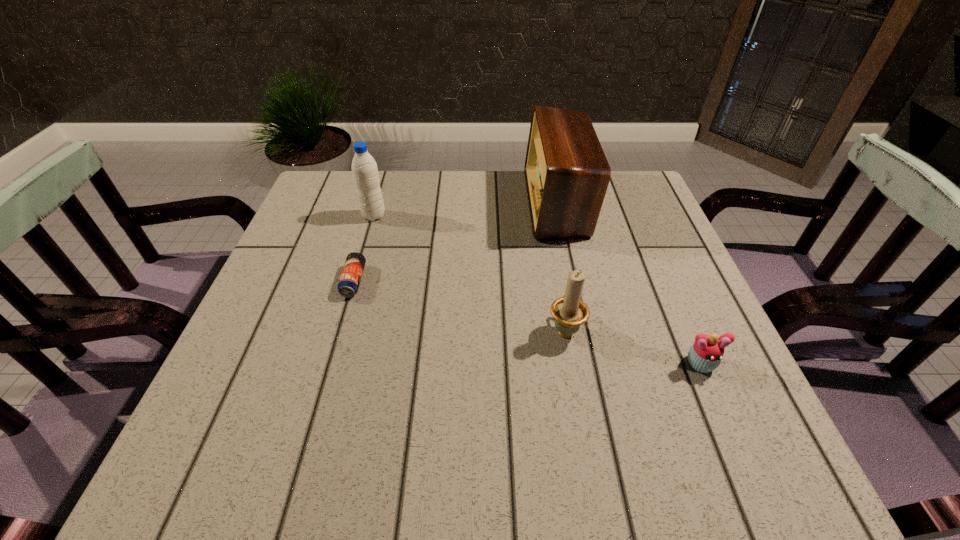
I want to click on free point between the water bottle and the third farthest object, so click(364, 248).

At what (x,y) coordinates should I click in order to perform the action: click on free spot between the cupcake and the water bottle. Please return your answer as a coordinate pair (x, y). Looking at the image, I should click on (537, 290).

Locate an element on the screen. Image resolution: width=960 pixels, height=540 pixels. free area in between the beer can and the radio receiver is located at coordinates (455, 242).

The width and height of the screenshot is (960, 540). What are the coordinates of `vacant point located between the radio receiver and the third nearest object` in the screenshot? It's located at (455, 242).

This screenshot has height=540, width=960. In order to click on vacant region between the radio receiver and the beer can in this screenshot , I will do `click(455, 242)`.

Where is `vacant area that lies between the radio receiver and the candle_holder`? This screenshot has width=960, height=540. vacant area that lies between the radio receiver and the candle_holder is located at coordinates (561, 266).

The image size is (960, 540). In order to click on free space between the second shortest object and the water bottle in this screenshot , I will do `click(537, 290)`.

Where is `free space that is in between the fourth tallest object and the water bottle`? free space that is in between the fourth tallest object and the water bottle is located at coordinates pyautogui.click(x=537, y=290).

The width and height of the screenshot is (960, 540). I want to click on vacant area that lies between the fourth farthest object and the water bottle, so click(x=469, y=273).

Locate which object ranks second in proximity to the water bottle. Please provide its 2D coordinates. Your answer should be formatted as a tuple, i.e. [(x, y)], where the tuple contains the x and y coordinates of a point satisfying the conditions above.

[(567, 174)]